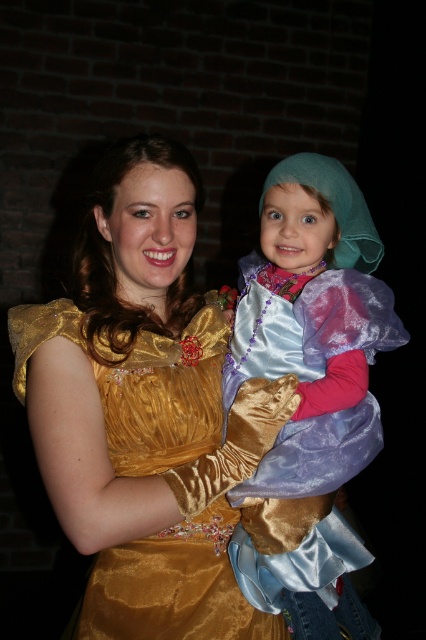
You are a photographer at a costume party and need to capture both the gold satin dress at center and the shiny satin dress at center in a single shot. Since the camera can only focus on one subject at a time, which dress should you focus on to ensure the other is still visible in the background?

The gold satin dress at center is positioned over the shiny satin dress at center, so focusing on the gold satin dress at center will keep the shiny satin dress at center in the background.

You are organizing a costume party and need to arrange two dresses in a display case. The gold satin dress at center and the shiny satin dress at center must be placed side by side. Given that the display case has a width of 1.2 meters, will both dresses fit if they are placed next to each other?

The gold satin dress at center is wider than the shiny satin dress at center. However, without knowing their exact widths, we cannot determine if they will fit in the 1.2 meters display case. More information is needed.